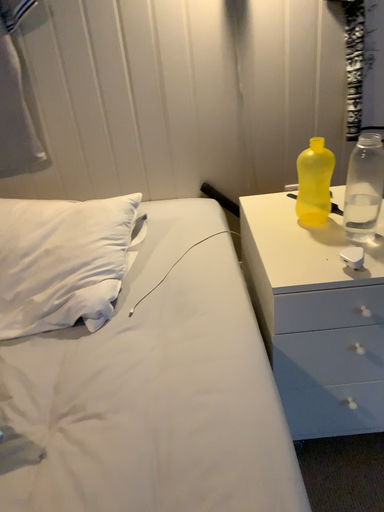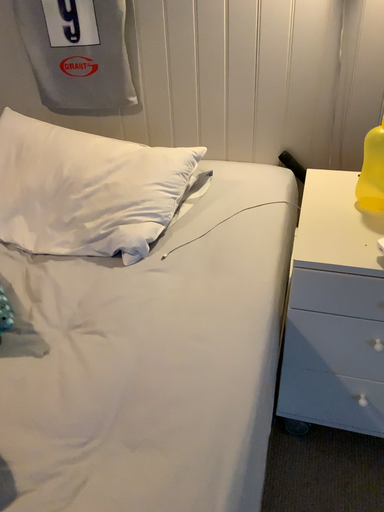
Question: Which way did the camera rotate in the video?

Choices:
 (A) rotated right
 (B) rotated left

Answer: (B)